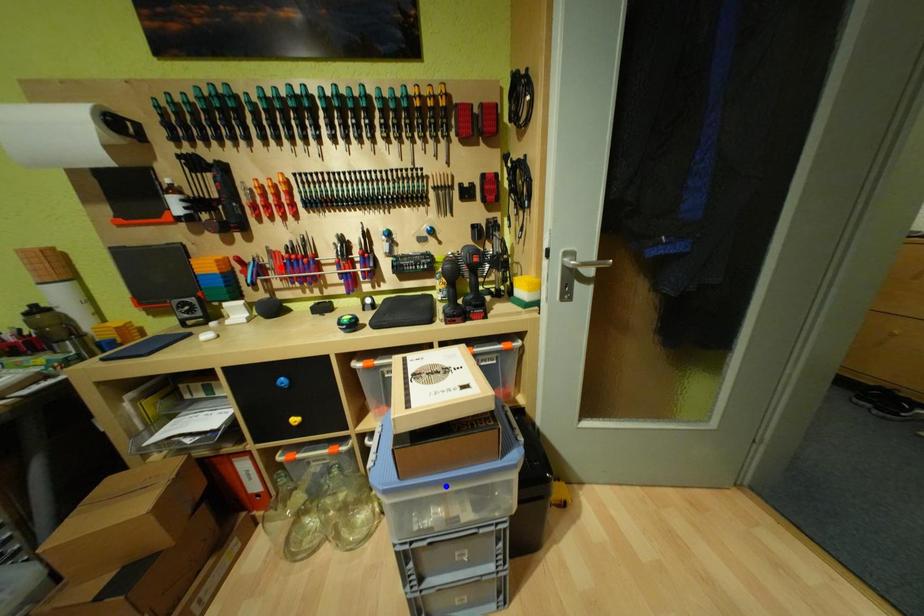
Question: In the image, two points are highlighted. Which point is nearer to the camera? Reply with the corresponding letter.

Choices:
 (A) blue point
 (B) red point

Answer: (A)